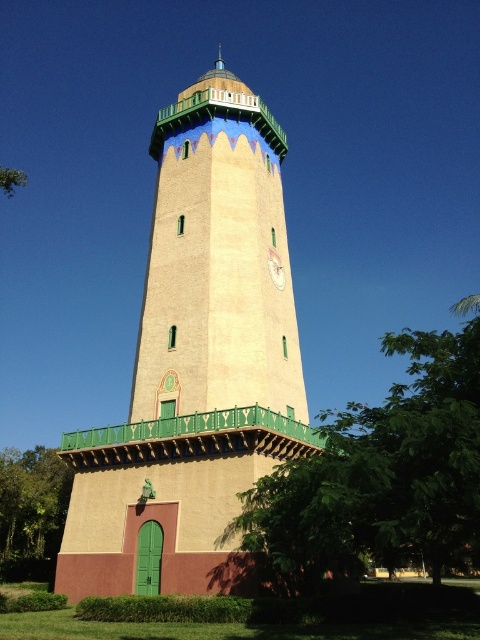
Where is `beige stucco bell tower at center`? The height and width of the screenshot is (640, 480). beige stucco bell tower at center is located at coordinates (195, 362).

What do you see at coordinates (195, 362) in the screenshot? I see `beige stucco bell tower at center` at bounding box center [195, 362].

Between point (291, 353) and point (29, 552), which one is positioned behind?

The point (29, 552) is more distant.

I want to click on beige stucco bell tower at center, so click(195, 362).

Does green leafy tree at center lie behind matte gold clock at center?

No, it is in front of matte gold clock at center.

Can you confirm if green leafy tree at center is positioned to the right of matte gold clock at center?

Indeed, green leafy tree at center is positioned on the right side of matte gold clock at center.

This screenshot has height=640, width=480. Describe the element at coordinates (381, 474) in the screenshot. I see `green leafy tree at center` at that location.

The image size is (480, 640). In order to click on green leafy tree at center in this screenshot , I will do `click(381, 474)`.

Between beige stucco bell tower at center and green leafy tree at center, which one has more height?

beige stucco bell tower at center

Is point (164, 400) positioned behind point (375, 550)?

Yes, it is.

At what (x,y) coordinates should I click in order to perform the action: click on beige stucco bell tower at center. Please return your answer as a coordinate pair (x, y). Image resolution: width=480 pixels, height=640 pixels. Looking at the image, I should click on (195, 362).